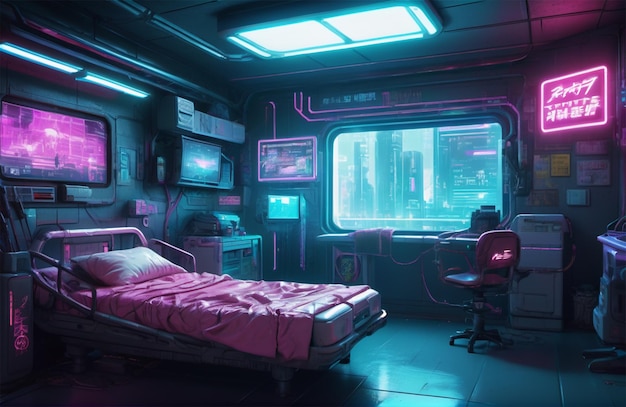
Find the location of a particular element. This screenshot has width=626, height=407. chair is located at coordinates (495, 276).